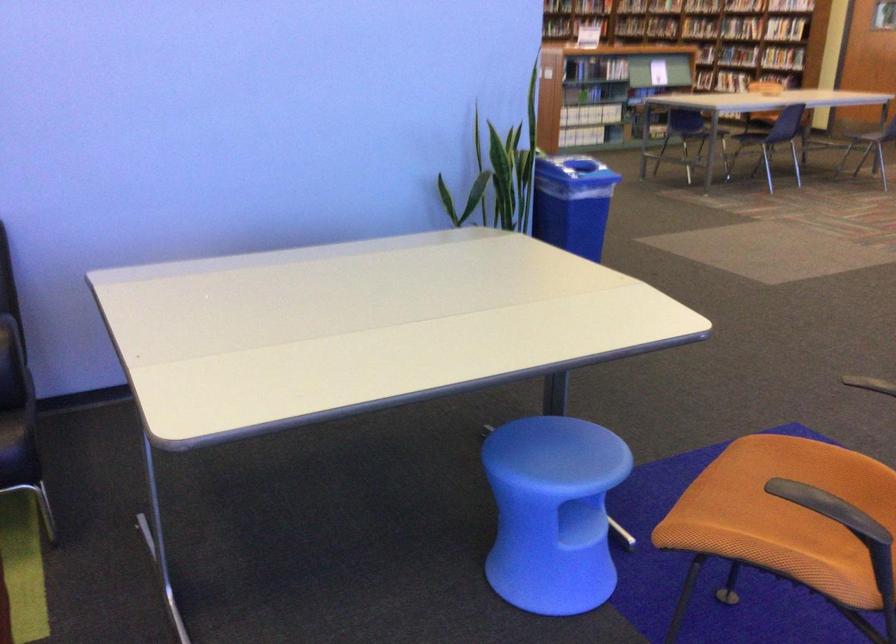
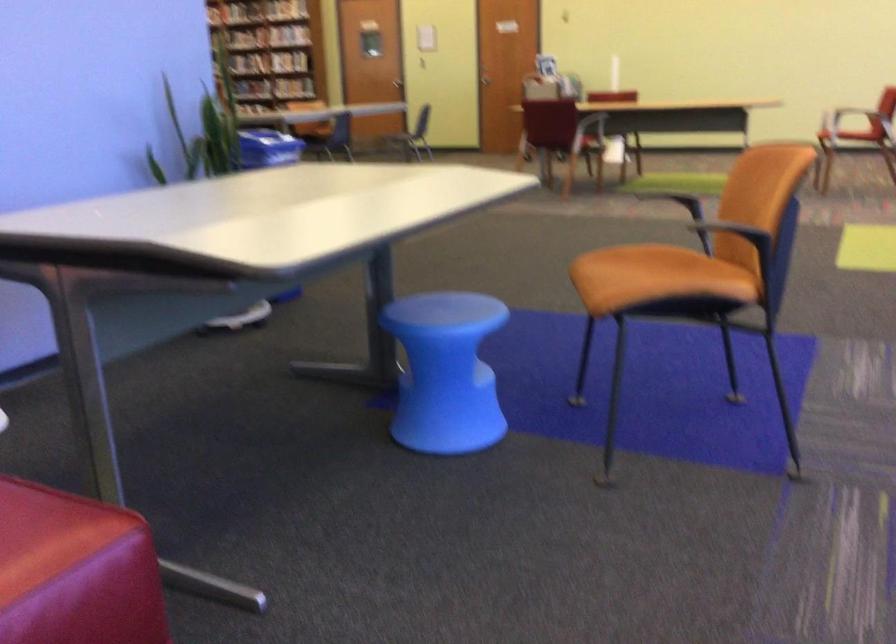
Where in the second image is the point corresponding to [528,520] from the first image?

(445, 372)